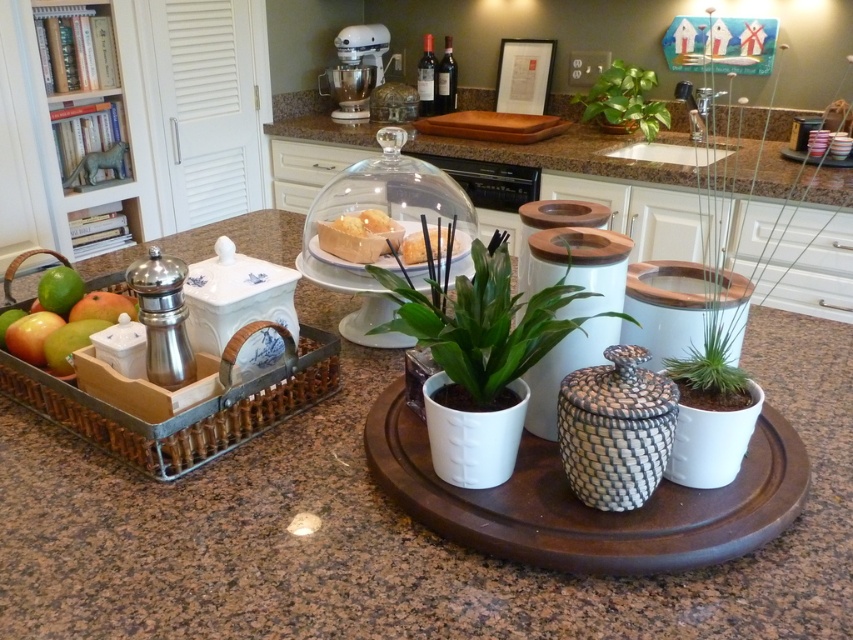
Is point (503, 317) less distant than point (347, 230)?

Yes, it is.

Which is behind, point (476, 275) or point (386, 220)?

The point (386, 220) is behind.

At what (x,y) coordinates should I click in order to perform the action: click on green matte plant at center. Please return your answer as a coordinate pair (x, y). Image resolution: width=853 pixels, height=640 pixels. Looking at the image, I should click on (485, 323).

Image resolution: width=853 pixels, height=640 pixels. What do you see at coordinates (624, 100) in the screenshot?
I see `green glossy plant at upper right` at bounding box center [624, 100].

Which is more to the right, green glossy plant at upper right or translucent glass bread at center?

green glossy plant at upper right is more to the right.

Find the location of a particular element. green glossy plant at upper right is located at coordinates (624, 100).

Which is behind, point (500, 384) or point (630, 90)?

The point (630, 90) is more distant.

Which of these two, green matte plant at center or green glossy plant at upper right, stands shorter?

green matte plant at center

Is point (508, 310) positioned after point (595, 84)?

No, it is in front of (595, 84).

The height and width of the screenshot is (640, 853). Find the location of `green matte plant at center`. green matte plant at center is located at coordinates (485, 323).